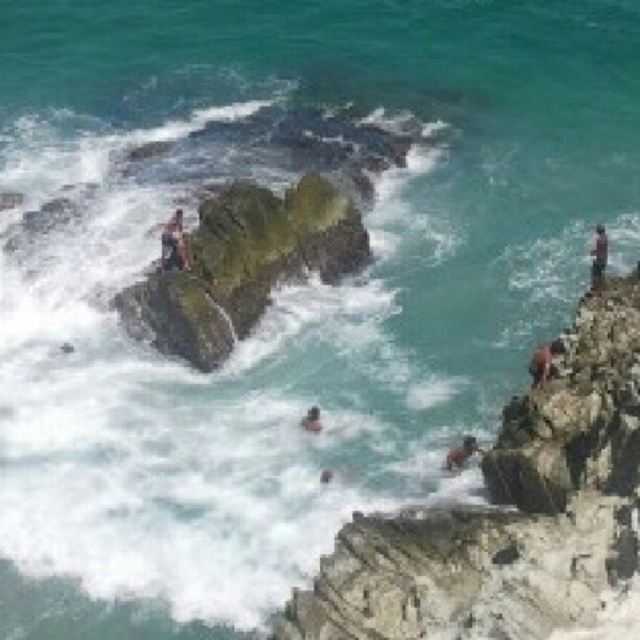
Does smooth skin person at right lie behind smooth skin person at center?

No.

Does smooth skin person at right have a greater height compared to smooth skin person at center?

Correct, smooth skin person at right is much taller as smooth skin person at center.

Where is `smooth skin person at right`? The width and height of the screenshot is (640, 640). smooth skin person at right is located at coordinates (545, 360).

Does point (179, 246) come behind point (548, 358)?

Yes, point (179, 246) is behind point (548, 358).

Is point (184, 241) positioned in front of point (532, 372)?

No, it is not.

Image resolution: width=640 pixels, height=640 pixels. What do you see at coordinates (173, 243) in the screenshot?
I see `smooth skin person at center-left` at bounding box center [173, 243].

What are the coordinates of `smooth skin person at center-left` in the screenshot? It's located at (173, 243).

Is smooth skin person at center-left bigger than smooth tan skin at lower center?

Actually, smooth skin person at center-left might be smaller than smooth tan skin at lower center.

Measure the distance between point (168,228) and camera.

Point (168,228) is 51.89 meters away from camera.

Does point (164, 243) lie behind point (460, 444)?

That is True.

The width and height of the screenshot is (640, 640). Identify the location of smooth skin person at center-left. (173, 243).